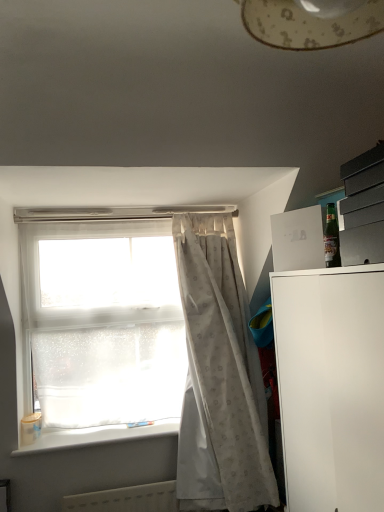
What is the approximate height of white plastic window sill at lower left?

white plastic window sill at lower left is 1.68 inches tall.

Locate an element on the screen. white textured curtain at center is located at coordinates (219, 377).

Would you say white textured curtain at center is part of white plastic window sill at lower left's contents?

Actually, white textured curtain at center is outside white plastic window sill at lower left.

Which of these two, white plastic window sill at lower left or white textured curtain at center, stands shorter?

With less height is white plastic window sill at lower left.

Is white plastic window sill at lower left aimed at white textured curtain at center?

No, white plastic window sill at lower left is not aimed at white textured curtain at center.

Does point (98, 492) come farther from viewer compared to point (224, 506)?

Yes, it is behind point (224, 506).

Is white plastic radiator at lower center thinner than white textured curtain at center?

Indeed, white plastic radiator at lower center has a lesser width compared to white textured curtain at center.

Who is shorter, white plastic radiator at lower center or white textured curtain at center?

With less height is white plastic radiator at lower center.

From the image's perspective, is white plastic radiator at lower center on top of white textured curtain at center?

Actually, white plastic radiator at lower center appears below white textured curtain at center in the image.

From the image's perspective, is white plastic window sill at lower left located beneath white matte/file cabinet at right?

Yes, from the image's perspective, white plastic window sill at lower left is below white matte/file cabinet at right.

Does white plastic window sill at lower left have a larger size compared to white matte/file cabinet at right?

No.

This screenshot has height=512, width=384. In order to click on window sill located on the left of white matte/file cabinet at right in this screenshot , I will do `click(96, 436)`.

Which object is more forward, white plastic window sill at lower left or white matte/file cabinet at right?

white matte/file cabinet at right is in front.

Is white plastic radiator at lower center facing towards transparent plastic window at upper left?

No, white plastic radiator at lower center does not turn towards transparent plastic window at upper left.

Who is bigger, white plastic radiator at lower center or transparent plastic window at upper left?

Bigger between the two is transparent plastic window at upper left.

How far apart are white plastic radiator at lower center and transparent plastic window at upper left?

The distance of white plastic radiator at lower center from transparent plastic window at upper left is 20.44 inches.

Could you tell me if green glass bottle at upper right is turned towards white plastic window sill at lower left?

No, green glass bottle at upper right does not turn towards white plastic window sill at lower left.

Does point (338, 261) appear closer or farther from the camera than point (63, 441)?

Point (338, 261) appears to be closer to the viewer than point (63, 441).

Is green glass bottle at upper right inside or outside of white plastic window sill at lower left?

green glass bottle at upper right cannot be found inside white plastic window sill at lower left.

Which is more to the left, green glass bottle at upper right or white plastic window sill at lower left?

From the viewer's perspective, white plastic window sill at lower left appears more on the left side.

Looking at this image, does white plastic radiator at lower center appear on the right side of green glass bottle at upper right?

Incorrect, white plastic radiator at lower center is not on the right side of green glass bottle at upper right.

Looking at the image, does white plastic radiator at lower center seem bigger or smaller compared to green glass bottle at upper right?

Considering their sizes, white plastic radiator at lower center takes up more space than green glass bottle at upper right.

Is white plastic radiator at lower center not near green glass bottle at upper right?

Indeed, white plastic radiator at lower center is not near green glass bottle at upper right.

From a real-world perspective, is white plastic radiator at lower center on green glass bottle at upper right?

Incorrect, from a real-world perspective, white plastic radiator at lower center is lower than green glass bottle at upper right.

Is white textured curtain at center bigger or smaller than transparent plastic window at upper left?

Considering their sizes, white textured curtain at center takes up more space than transparent plastic window at upper left.

From a real-world perspective, is white textured curtain at center above or below transparent plastic window at upper left?

In terms of real-world spatial position, white textured curtain at center is below transparent plastic window at upper left.

How much distance is there between white textured curtain at center and transparent plastic window at upper left?

white textured curtain at center and transparent plastic window at upper left are 4.37 inches apart.

At what (x,y) coordinates should I click in order to perform the action: click on curtain on the right of white plastic window sill at lower left. Please return your answer as a coordinate pair (x, y). Looking at the image, I should click on (219, 377).

I want to click on curtain above the white plastic radiator at lower center (from the image's perspective), so click(x=219, y=377).

Looking at the image, which one is located closer to white plastic radiator at lower center, green glass bottle at upper right or transparent plastic window at upper left?

transparent plastic window at upper left is positioned closer to the anchor white plastic radiator at lower center.

Based on their spatial positions, is white plastic window sill at lower left or green glass bottle at upper right closer to white textured curtain at center?

Based on the image, white plastic window sill at lower left appears to be nearer to white textured curtain at center.

Looking at the image, which one is located further to transparent plastic window at upper left, green glass bottle at upper right or white plastic window sill at lower left?

Among the two, green glass bottle at upper right is located further to transparent plastic window at upper left.

Considering their positions, is white matte/file cabinet at right positioned closer to transparent plastic window at upper left than white plastic radiator at lower center?

Based on the image, white plastic radiator at lower center appears to be nearer to transparent plastic window at upper left.

Looking at the image, which one is located further to white matte/file cabinet at right, white plastic radiator at lower center or white textured curtain at center?

white plastic radiator at lower center is positioned further to the anchor white matte/file cabinet at right.

Estimate the real-world distances between objects in this image. Which object is closer to white textured curtain at center, transparent plastic window at upper left or white plastic radiator at lower center?

Among the two, transparent plastic window at upper left is located nearer to white textured curtain at center.

Looking at the image, which one is located closer to white plastic radiator at lower center, white plastic window sill at lower left or white matte/file cabinet at right?

The object closer to white plastic radiator at lower center is white plastic window sill at lower left.

Based on their spatial positions, is white textured curtain at center or white plastic window sill at lower left closer to green glass bottle at upper right?

The object closer to green glass bottle at upper right is white textured curtain at center.

What are the coordinates of `window sill between transparent plastic window at upper left and white plastic radiator at lower center from top to bottom` in the screenshot? It's located at (96, 436).

The width and height of the screenshot is (384, 512). What are the coordinates of `window sill between green glass bottle at upper right and white plastic radiator at lower center vertically` in the screenshot? It's located at (96, 436).

This screenshot has width=384, height=512. In order to click on curtain between transparent plastic window at upper left and white plastic window sill at lower left vertically in this screenshot , I will do click(x=219, y=377).

Locate an element on the screen. window between white plastic window sill at lower left and green glass bottle at upper right is located at coordinates click(176, 370).